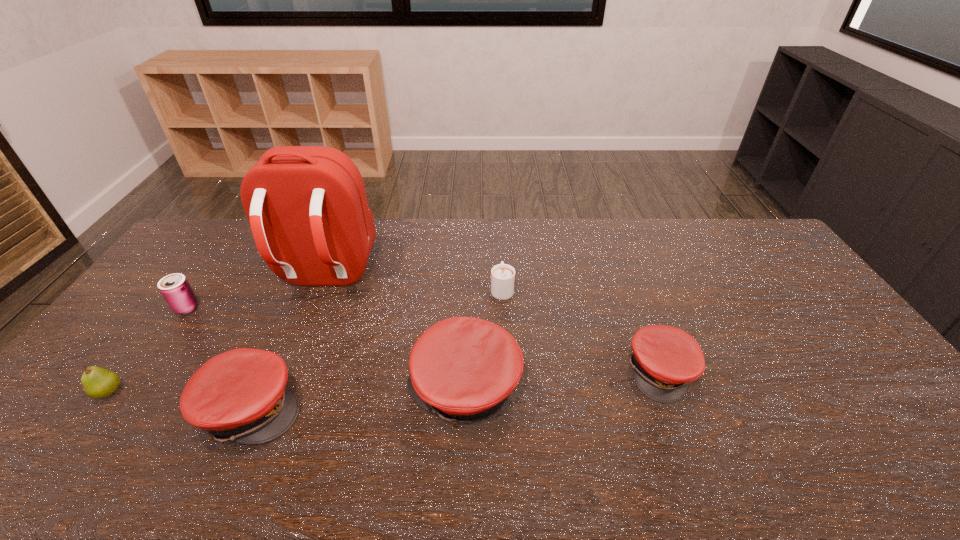
This screenshot has width=960, height=540. I want to click on the second tallest cap, so click(x=241, y=395).

Locate an element on the screen. This screenshot has height=540, width=960. the tallest cap is located at coordinates (463, 369).

Locate an element on the screen. The height and width of the screenshot is (540, 960). the sixth shortest object is located at coordinates (463, 369).

The image size is (960, 540). In order to click on the rightmost object in this screenshot , I will do `click(665, 359)`.

You are a GUI agent. You are given a task and a screenshot of the screen. Output one action in this format:
    pyautogui.click(x=<x>, y=<y>)
    Task: Click on the rightmost cap
    This screenshot has height=540, width=960.
    Given the screenshot: What is the action you would take?
    pyautogui.click(x=665, y=359)

Identify the location of can. The width and height of the screenshot is (960, 540). [175, 288].

Identify the location of backpack. This screenshot has height=540, width=960. (307, 207).

What are the coordinates of `cappuccino` in the screenshot? It's located at (502, 275).

You are a GUI agent. You are given a task and a screenshot of the screen. Output one action in this format:
    pyautogui.click(x=<x>, y=<y>)
    Task: Click on the pear
    The height and width of the screenshot is (540, 960).
    Given the screenshot: What is the action you would take?
    pyautogui.click(x=98, y=383)

You are a GUI agent. You are given a task and a screenshot of the screen. Output one action in this format:
    pyautogui.click(x=<x>, y=<y>)
    Task: Click on the vacant space located 0.150m on the front of the second shortest cap with an emblem
    This screenshot has height=540, width=960.
    Given the screenshot: What is the action you would take?
    pyautogui.click(x=360, y=408)